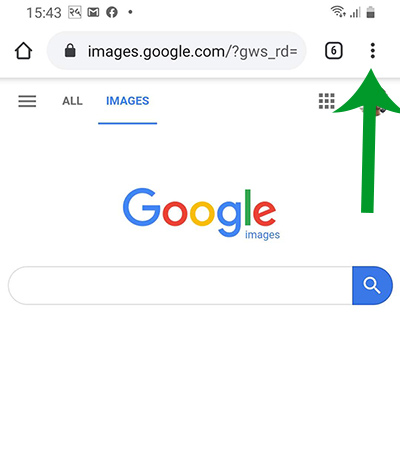
Locate an element on the screen. The width and height of the screenshot is (400, 454). phone clock is located at coordinates (46, 11).